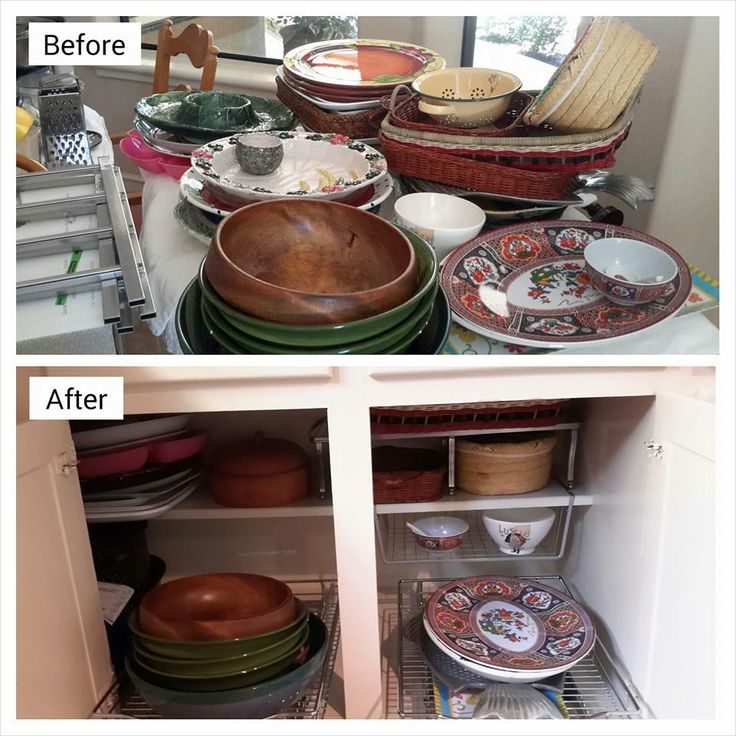
You are a GUI agent. You are given a task and a screenshot of the screen. Output one action in this format:
    pyautogui.click(x=<x>, y=<y>)
    Task: Click on the baskets
    
    Given the screenshot: What is the action you would take?
    click(x=509, y=463), click(x=612, y=71)